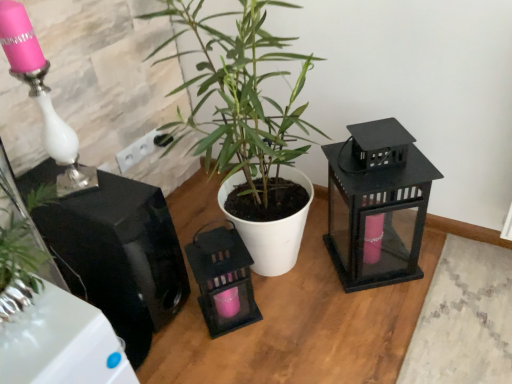
Question: Would you say glossy black speaker at left, which ranks as the 2th appliance in right-to-left order, is to the left or to the right of matte black lantern at right, acting as the first appliance starting from the right, in the picture?

Choices:
 (A) right
 (B) left

Answer: (B)

Question: From the image's perspective, relative to matte black lantern at right, acting as the first appliance starting from the right, is glossy black speaker at left, which is the 1th appliance in left-to-right order, above or below?

Choices:
 (A) above
 (B) below

Answer: (B)

Question: Which is farther from the glossy black speaker at left, which ranks as the 2th appliance in right-to-left order?

Choices:
 (A) matte black lantern at right, acting as the 2th appliance starting from the left
 (B) pink glass table lamp at left
 (C) green matte plant at center
 (D) white plastic electric outlet at upper center

Answer: (A)

Question: Estimate the real-world distances between objects in this image. Which object is closer to the matte black lantern at right, acting as the 2th appliance starting from the left?

Choices:
 (A) green matte plant at center
 (B) white plastic electric outlet at upper center
 (C) pink glass table lamp at left
 (D) glossy black speaker at left, which is the 1th appliance in left-to-right order

Answer: (A)